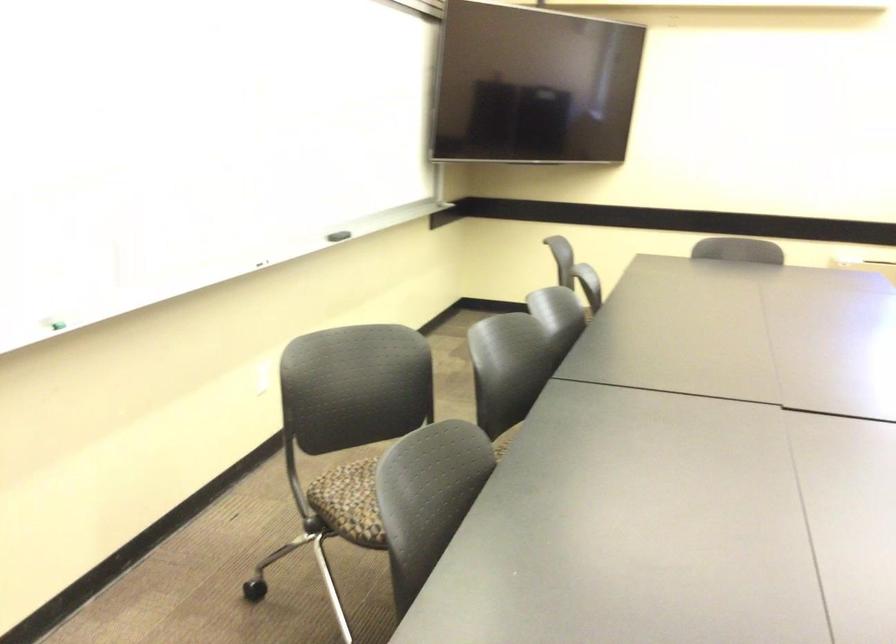
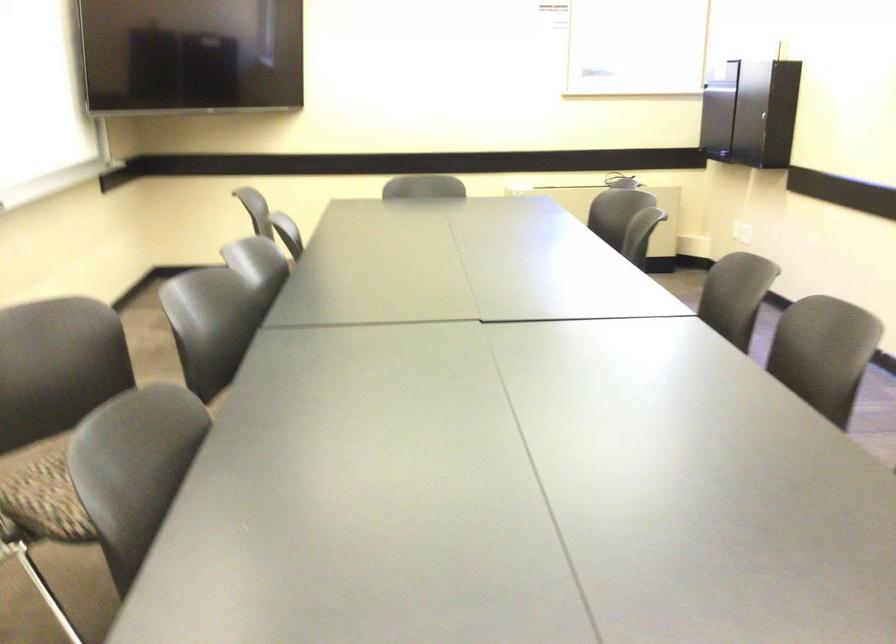
Which direction would the cameraman need to move to produce the second image?

The cameraman walked toward right, forward.